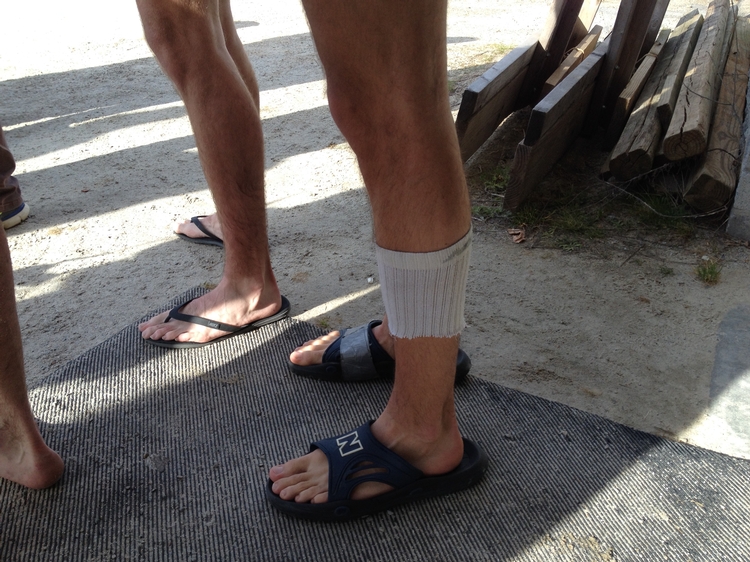
Where is `mat on ground`? mat on ground is located at coordinates (178, 405).